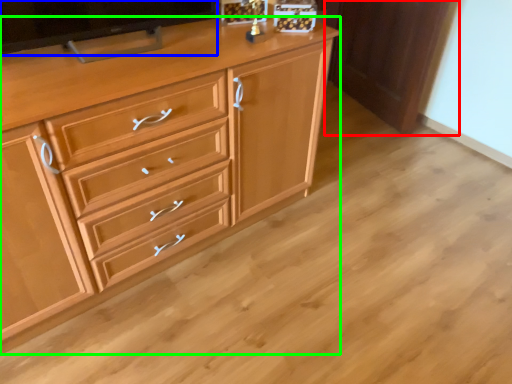
Question: Estimate the real-world distances between objects in this image. Which object is closer to cabinetry (highlighted by a red box), television (highlighted by a blue box) or chest of drawers (highlighted by a green box)?

Choices:
 (A) television
 (B) chest of drawers

Answer: (B)